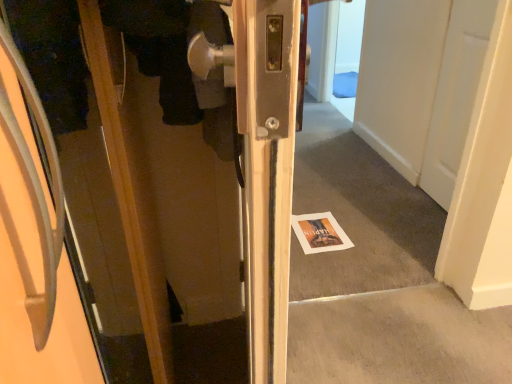
Question: From the image's perspective, is white paper magazine at center above or below matte wood door at left?

Choices:
 (A) above
 (B) below

Answer: (A)

Question: Which is correct: white paper magazine at center is inside matte wood door at left, or outside of it?

Choices:
 (A) outside
 (B) inside

Answer: (A)

Question: Considering the relative positions of white paper magazine at center and matte wood door at left in the image provided, is white paper magazine at center to the left or to the right of matte wood door at left?

Choices:
 (A) right
 (B) left

Answer: (A)

Question: In terms of width, does matte wood door at left look wider or thinner when compared to white paper magazine at center?

Choices:
 (A) thin
 (B) wide

Answer: (B)

Question: Does point (3, 382) appear closer or farther from the camera than point (331, 235)?

Choices:
 (A) closer
 (B) farther

Answer: (A)

Question: From the image's perspective, is matte wood door at left positioned above or below white paper magazine at center?

Choices:
 (A) below
 (B) above

Answer: (A)

Question: From a real-world perspective, relative to white paper magazine at center, is matte wood door at left vertically above or below?

Choices:
 (A) above
 (B) below

Answer: (A)